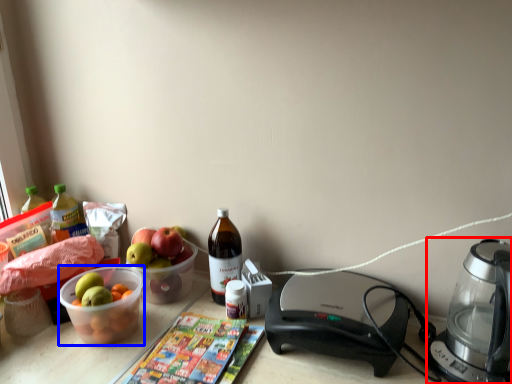
Question: Which object is closer to the camera taking this photo, coffee maker (highlighted by a red box) or bowl (highlighted by a blue box)?

Choices:
 (A) coffee maker
 (B) bowl

Answer: (A)